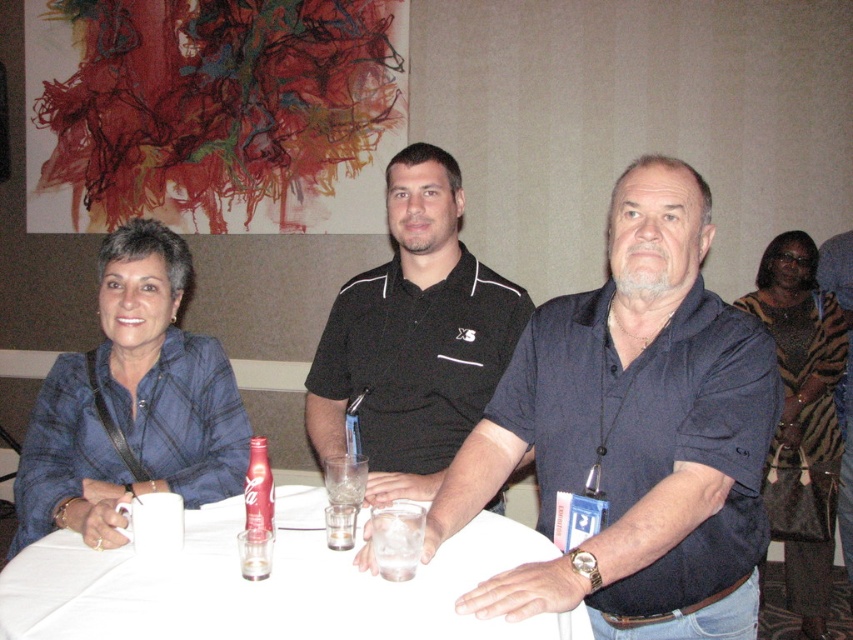
Which is below, white plastic table at center or tiger print scarf at center?

white plastic table at center is lower down.

In the scene shown: Which of these two, white plastic table at center or tiger print scarf at center, stands taller?

tiger print scarf at center

Image resolution: width=853 pixels, height=640 pixels. Describe the element at coordinates (259, 584) in the screenshot. I see `white plastic table at center` at that location.

Identify the location of white plastic table at center. (259, 584).

Between point (263, 592) and point (415, 518), which one is positioned behind?

The point (415, 518) is more distant.

Is white plastic table at center below clear glass ice at table center?

Yes, white plastic table at center is below clear glass ice at table center.

Find the location of a particular element. white plastic table at center is located at coordinates (259, 584).

The height and width of the screenshot is (640, 853). What do you see at coordinates (413, 339) in the screenshot? I see `black matte polo shirt at center` at bounding box center [413, 339].

Between point (467, 294) and point (395, 561), which one is positioned behind?

Point (467, 294)

Where is `black matte polo shirt at center`? Image resolution: width=853 pixels, height=640 pixels. black matte polo shirt at center is located at coordinates (413, 339).